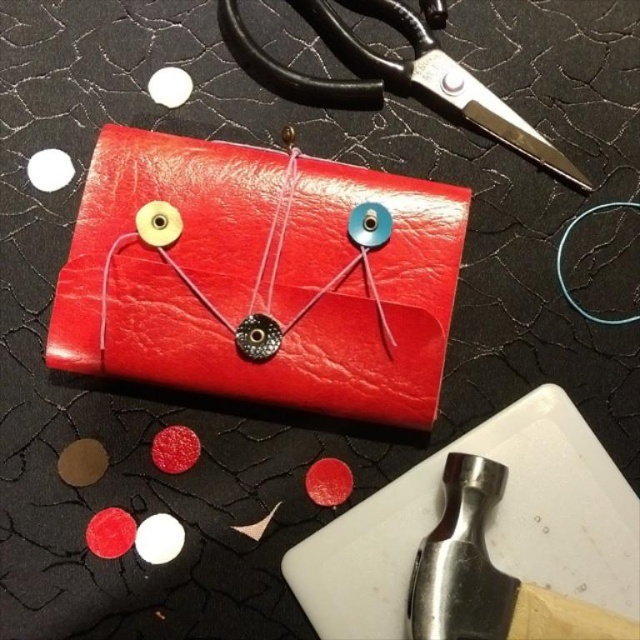
Does glossy leather clutch at center have a greater height compared to polished metal hammer at bottom right?

Correct, glossy leather clutch at center is much taller as polished metal hammer at bottom right.

Describe the element at coordinates (259, 275) in the screenshot. I see `glossy leather clutch at center` at that location.

Is point (448, 241) closer to camera compared to point (461, 564)?

No, it is not.

At what (x,y) coordinates should I click in order to perform the action: click on glossy leather clutch at center. Please return your answer as a coordinate pair (x, y). Image resolution: width=640 pixels, height=640 pixels. Looking at the image, I should click on (259, 275).

Is polished metal hammer at bottom right below black metal scissors at upper center?

Yes.

Measure the distance between point (577, 618) and camera.

Point (577, 618) is 3.71 feet from camera.

Which is behind, point (566, 616) or point (337, 24)?

The point (337, 24) is more distant.

In order to click on polished metal hammer at bottom right in this screenshot , I will do pyautogui.click(x=486, y=573).

Does glossy leather clutch at center have a greater width compared to black metal scissors at upper center?

Yes, glossy leather clutch at center is wider than black metal scissors at upper center.

Does glossy leather clutch at center have a larger size compared to black metal scissors at upper center?

Correct, glossy leather clutch at center is larger in size than black metal scissors at upper center.

At what (x,y) coordinates should I click in order to perform the action: click on glossy leather clutch at center. Please return your answer as a coordinate pair (x, y). Looking at the image, I should click on [259, 275].